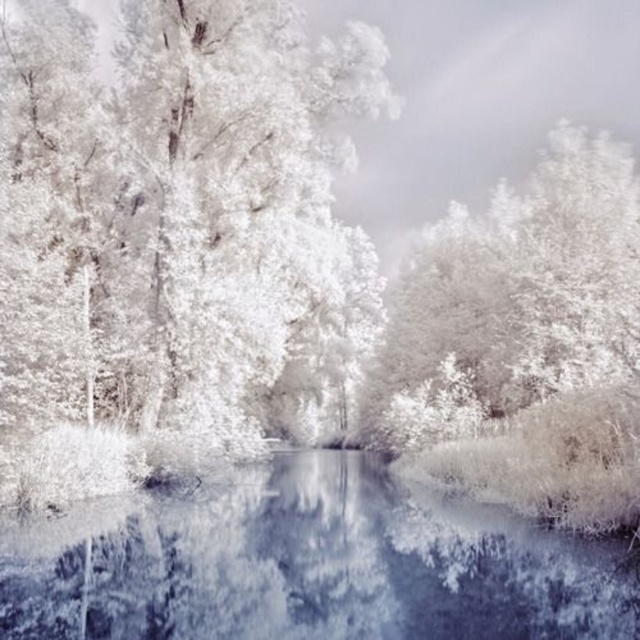
Which is more to the left, white frosty tree at left or translucent ice at center?

Positioned to the left is white frosty tree at left.

Between point (40, 26) and point (276, 484), which one is positioned in front?

Point (40, 26)

Where is `white frosty tree at left`? The image size is (640, 640). white frosty tree at left is located at coordinates (176, 240).